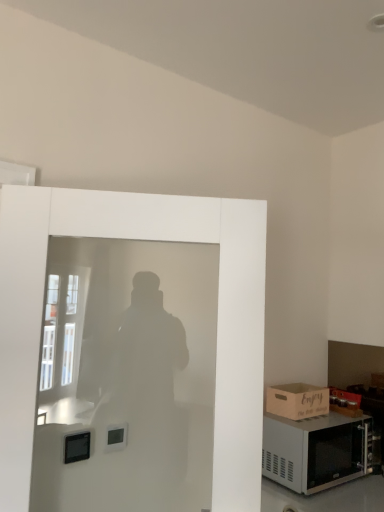
Question: From the image's perspective, is white frosted glass screen door at left located beneath brown cardboard box at lower right?

Choices:
 (A) yes
 (B) no

Answer: (B)

Question: Is white frosted glass screen door at left beside brown cardboard box at lower right?

Choices:
 (A) yes
 (B) no

Answer: (B)

Question: Does white frosted glass screen door at left have a smaller size compared to brown cardboard box at lower right?

Choices:
 (A) yes
 (B) no

Answer: (B)

Question: Does white frosted glass screen door at left have a greater height compared to brown cardboard box at lower right?

Choices:
 (A) yes
 (B) no

Answer: (A)

Question: Is white frosted glass screen door at left positioned with its back to brown cardboard box at lower right?

Choices:
 (A) no
 (B) yes

Answer: (A)

Question: Is white frosted glass screen door at left facing towards brown cardboard box at lower right?

Choices:
 (A) no
 (B) yes

Answer: (A)

Question: From the image's perspective, is satin silver microwave at lower right above white frosted glass screen door at left?

Choices:
 (A) no
 (B) yes

Answer: (A)

Question: From a real-world perspective, is satin silver microwave at lower right located higher than white frosted glass screen door at left?

Choices:
 (A) no
 (B) yes

Answer: (A)

Question: Is satin silver microwave at lower right positioned behind white frosted glass screen door at left?

Choices:
 (A) yes
 (B) no

Answer: (A)

Question: Is satin silver microwave at lower right beside white frosted glass screen door at left?

Choices:
 (A) yes
 (B) no

Answer: (B)

Question: Is satin silver microwave at lower right positioned in front of white frosted glass screen door at left?

Choices:
 (A) yes
 (B) no

Answer: (B)

Question: Considering the relative sizes of satin silver microwave at lower right and white frosted glass screen door at left in the image provided, is satin silver microwave at lower right thinner than white frosted glass screen door at left?

Choices:
 (A) no
 (B) yes

Answer: (A)

Question: Is brown cardboard box at lower right smaller than satin silver microwave at lower right?

Choices:
 (A) no
 (B) yes

Answer: (B)